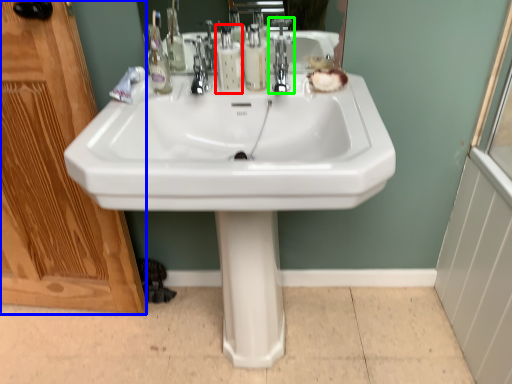
Question: Based on their relative distances, which object is nearer to soap dispenser (highlighted by a red box)? Choose from screen door (highlighted by a blue box) and tap (highlighted by a green box).

Choices:
 (A) screen door
 (B) tap

Answer: (B)